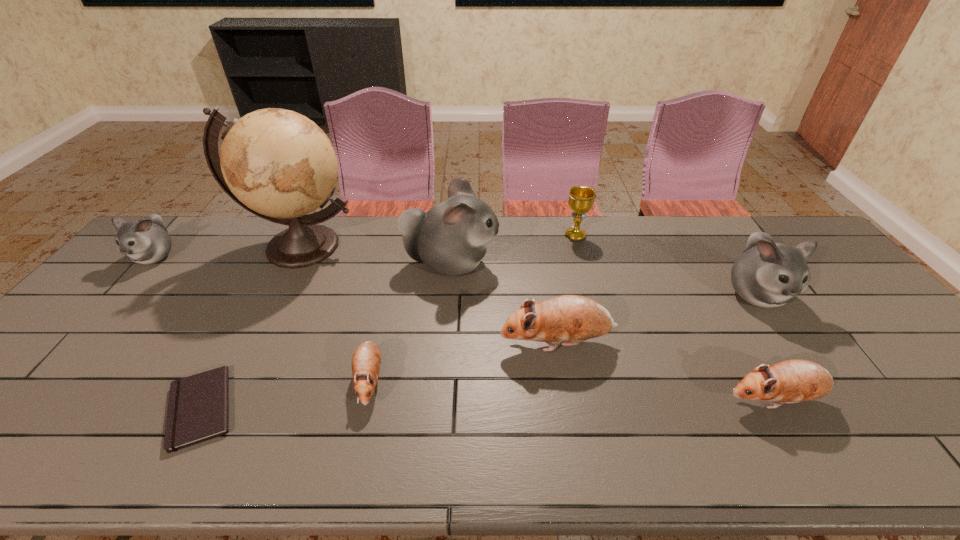
At what (x,y) coordinates should I click in order to perform the action: click on object that is at the left edge. Please return your answer as a coordinate pair (x, y). Image resolution: width=960 pixels, height=540 pixels. Looking at the image, I should click on (146, 241).

At what (x,y) coordinates should I click in order to perform the action: click on object located at the far left corner. Please return your answer as a coordinate pair (x, y). Looking at the image, I should click on [146, 241].

In the image, there is a desktop. Identify the location of free space at the far edge. This screenshot has width=960, height=540. (247, 226).

Where is `vacant area at the left edge`? This screenshot has height=540, width=960. vacant area at the left edge is located at coordinates click(x=106, y=342).

Where is `vacant space at the right edge`? vacant space at the right edge is located at coordinates (824, 268).

Locate an element on the screen. This screenshot has height=540, width=960. unoccupied area between the shortest object and the globe is located at coordinates (251, 327).

The width and height of the screenshot is (960, 540). In order to click on vacant space that's between the second brown hamster from left to right and the smallest brown hamster in this screenshot , I will do `click(464, 362)`.

You are a GUI agent. You are given a task and a screenshot of the screen. Output one action in this format:
    pyautogui.click(x=<x>, y=<y>)
    Task: Click on the unoccupied area between the leftmost white hamster and the shortest object
    This screenshot has height=540, width=960.
    Given the screenshot: What is the action you would take?
    pyautogui.click(x=179, y=332)

Where is `empty space between the tallest object and the smallest brown hamster`? empty space between the tallest object and the smallest brown hamster is located at coordinates (335, 314).

Identify the location of empty space that is in between the tallest object and the biggest white hamster. The height and width of the screenshot is (540, 960). point(375,255).